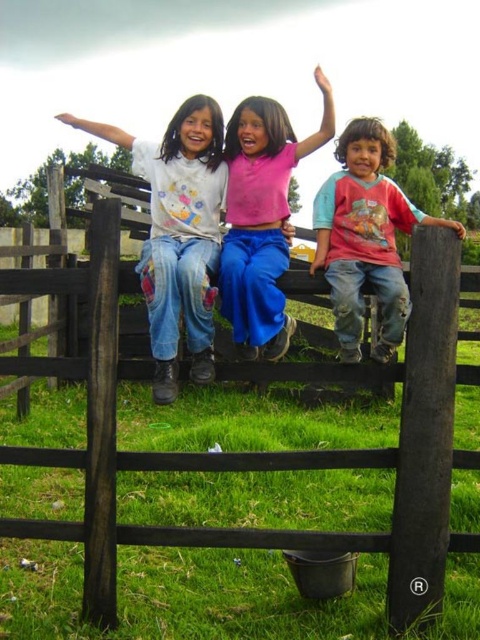
Question: Can you confirm if black wooden fence at center is positioned above denim jeans at left?

Choices:
 (A) no
 (B) yes

Answer: (A)

Question: Among these objects, which one is farthest from the camera?

Choices:
 (A) pink matte shirt at center
 (B) black wooden fence at center

Answer: (B)

Question: Which object is the closest to the black wooden fence at center?

Choices:
 (A) rough denim jeans at right
 (B) pink matte shirt at center
 (C) denim jeans at left

Answer: (C)

Question: Which of the following is the farthest from the observer?

Choices:
 (A) (399, 218)
 (B) (244, 326)
 (C) (200, 291)
 (D) (448, 413)

Answer: (A)

Question: Does black wooden fence at center come behind pink matte shirt at center?

Choices:
 (A) no
 (B) yes

Answer: (B)

Question: In this image, where is black wooden fence at center located relative to pink matte shirt at center?

Choices:
 (A) right
 (B) left

Answer: (B)